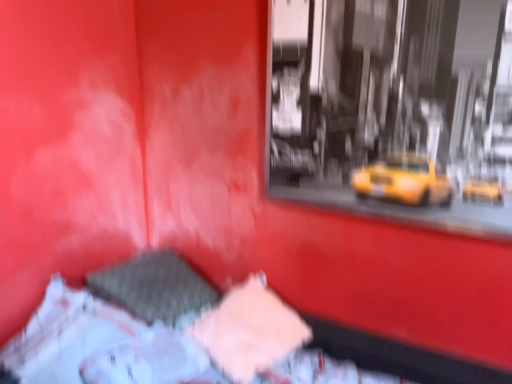
Describe the element at coordinates (250, 330) in the screenshot. The height and width of the screenshot is (384, 512). I see `pink fabric at center` at that location.

At what (x,y) coordinates should I click in order to perform the action: click on pink fabric at center. Please return your answer as a coordinate pair (x, y). Looking at the image, I should click on (250, 330).

What do you see at coordinates (104, 315) in the screenshot? I see `textured fabric bed at center` at bounding box center [104, 315].

Identify the location of textured fabric bed at center. (104, 315).

Locate an element on the screen. pink fabric at center is located at coordinates (250, 330).

Can you confirm if pink fabric at center is positioned to the right of textured fabric bed at center?

Yes, pink fabric at center is to the right of textured fabric bed at center.

Between pink fabric at center and textured fabric bed at center, which one is positioned in front?

textured fabric bed at center is more forward.

Does point (248, 375) appear closer or farther from the camera than point (119, 287)?

Point (248, 375).

In the scene shown: From the image's perspective, does pink fabric at center appear lower than textured fabric bed at center?

No, from the image's perspective, pink fabric at center is not below textured fabric bed at center.

From a real-world perspective, is pink fabric at center beneath textured fabric bed at center?

Yes, from a real-world perspective, pink fabric at center is under textured fabric bed at center.

Which of these two, pink fabric at center or textured fabric bed at center, is wider?

With larger width is textured fabric bed at center.

Does pink fabric at center have a greater height compared to textured fabric bed at center?

No, pink fabric at center is not taller than textured fabric bed at center.

Considering the sizes of objects pink fabric at center and textured fabric bed at center in the image provided, who is bigger, pink fabric at center or textured fabric bed at center?

textured fabric bed at center.

Which is correct: pink fabric at center is inside textured fabric bed at center, or outside of it?

pink fabric at center is located inside textured fabric bed at center.

Does pink fabric at center touch textured fabric bed at center?

There is a gap between pink fabric at center and textured fabric bed at center.

Is pink fabric at center facing towards textured fabric bed at center?

Yes, pink fabric at center faces towards textured fabric bed at center.

Where is `sheet that is on the right side of textured fabric bed at center`? The image size is (512, 384). sheet that is on the right side of textured fabric bed at center is located at coordinates (250, 330).

Is textured fabric bed at center to the left of pink fabric at center from the viewer's perspective?

Indeed, textured fabric bed at center is positioned on the left side of pink fabric at center.

Is textured fabric bed at center closer to the viewer compared to pink fabric at center?

Yes, it is in front of pink fabric at center.

Between point (98, 309) and point (253, 303), which one is positioned in front?

The point (98, 309) is closer to the camera.

From the image's perspective, which one is positioned higher, textured fabric bed at center or pink fabric at center?

From the image's view, pink fabric at center is above.

In the scene shown: From a real-world perspective, is textured fabric bed at center located beneath pink fabric at center?

No, from a real-world perspective, textured fabric bed at center is not below pink fabric at center.

Considering the relative sizes of textured fabric bed at center and pink fabric at center in the image provided, is textured fabric bed at center thinner than pink fabric at center?

In fact, textured fabric bed at center might be wider than pink fabric at center.

Can you confirm if textured fabric bed at center is taller than pink fabric at center?

Yes, textured fabric bed at center is taller than pink fabric at center.

Does textured fabric bed at center have a larger size compared to pink fabric at center?

Indeed, textured fabric bed at center has a larger size compared to pink fabric at center.

Is pink fabric at center located within textured fabric bed at center?

Yes, pink fabric at center is a part of textured fabric bed at center.

Would you say textured fabric bed at center is a long distance from pink fabric at center?

Actually, textured fabric bed at center and pink fabric at center are a little close together.

Is textured fabric bed at center facing towards pink fabric at center?

Yes, textured fabric bed at center is turned towards pink fabric at center.

How different are the orientations of textured fabric bed at center and pink fabric at center in degrees?

They differ by 81.2 degrees in their facing directions.

Image resolution: width=512 pixels, height=384 pixels. There is a pink fabric at center. Identify the location of bed above it (from a real-world perspective). (104, 315).

Where is `sheet that is above the textured fabric bed at center (from the image's perspective)`? The image size is (512, 384). sheet that is above the textured fabric bed at center (from the image's perspective) is located at coordinates (250, 330).

This screenshot has width=512, height=384. I want to click on bed below the pink fabric at center (from the image's perspective), so click(104, 315).